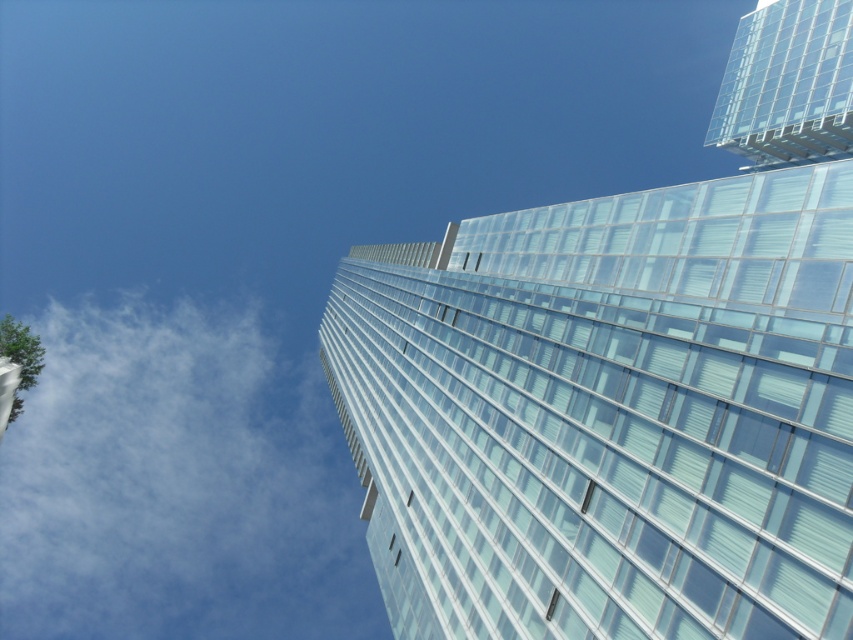
Between transparent glass building at upper center and white fluffy cloud at upper left, which one is positioned lower?

Positioned lower is white fluffy cloud at upper left.

Where is `transparent glass building at upper center`? transparent glass building at upper center is located at coordinates (608, 413).

Is transparent glass building at upper center to the left of transparent glass building at upper right from the viewer's perspective?

Indeed, transparent glass building at upper center is positioned on the left side of transparent glass building at upper right.

Can you confirm if transparent glass building at upper center is shorter than transparent glass building at upper right?

No.

This screenshot has width=853, height=640. What are the coordinates of `transparent glass building at upper center` in the screenshot? It's located at (608, 413).

Can you confirm if white fluffy cloud at upper left is positioned below transparent glass building at upper right?

Yes, white fluffy cloud at upper left is below transparent glass building at upper right.

Describe the element at coordinates (178, 483) in the screenshot. I see `white fluffy cloud at upper left` at that location.

Locate an element on the screen. white fluffy cloud at upper left is located at coordinates (178, 483).